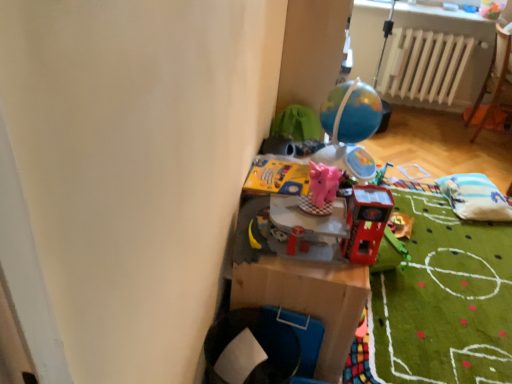
Question: Is shiny metallic globe at upper center, arranged as the first toy when viewed from the back, to the right of white matte radiator at upper right from the viewer's perspective?

Choices:
 (A) yes
 (B) no

Answer: (B)

Question: From a real-world perspective, is shiny metallic globe at upper center, the 4th toy positioned from the front, beneath white matte radiator at upper right?

Choices:
 (A) no
 (B) yes

Answer: (A)

Question: Can you confirm if shiny metallic globe at upper center, the 4th toy positioned from the front, is taller than white matte radiator at upper right?

Choices:
 (A) no
 (B) yes

Answer: (A)

Question: Is shiny metallic globe at upper center, arranged as the first toy when viewed from the back, bigger than white matte radiator at upper right?

Choices:
 (A) no
 (B) yes

Answer: (A)

Question: Is shiny metallic globe at upper center, the 4th toy positioned from the front, smaller than white matte radiator at upper right?

Choices:
 (A) yes
 (B) no

Answer: (A)

Question: From the image's perspective, is yellow cardboard book at center, positioned as the 2th toy in back-to-front order, above or below pink rubber elephant at center, the 3th toy in the back-to-front sequence?

Choices:
 (A) below
 (B) above

Answer: (B)

Question: From a real-world perspective, is yellow cardboard book at center, positioned as the 2th toy in back-to-front order, positioned above or below pink rubber elephant at center, the 3th toy in the back-to-front sequence?

Choices:
 (A) below
 (B) above

Answer: (A)

Question: Looking at their shapes, would you say yellow cardboard book at center, positioned as the 2th toy in back-to-front order, is wider or thinner than pink rubber elephant at center, which appears as the 2th toy when viewed from the front?

Choices:
 (A) wide
 (B) thin

Answer: (A)

Question: In terms of size, does yellow cardboard book at center, positioned as the 2th toy in back-to-front order, appear bigger or smaller than pink rubber elephant at center, the 3th toy in the back-to-front sequence?

Choices:
 (A) big
 (B) small

Answer: (B)

Question: Looking at their shapes, would you say shiny metallic globe at upper center, the 4th toy positioned from the front, is wider or thinner than white fabric bean bag at right?

Choices:
 (A) wide
 (B) thin

Answer: (B)

Question: Relative to white fabric bean bag at right, is shiny metallic globe at upper center, the 4th toy positioned from the front, in front or behind?

Choices:
 (A) behind
 (B) front

Answer: (B)

Question: Is shiny metallic globe at upper center, the 4th toy positioned from the front, situated inside white fabric bean bag at right or outside?

Choices:
 (A) outside
 (B) inside

Answer: (A)

Question: Based on their positions, is shiny metallic globe at upper center, the 4th toy positioned from the front, located to the left or right of white fabric bean bag at right?

Choices:
 (A) right
 (B) left

Answer: (B)

Question: Considering their positions, is metallic red dartboard at center, the 1th toy when ordered from front to back, located in front of or behind white matte radiator at upper right?

Choices:
 (A) behind
 (B) front

Answer: (B)

Question: Looking at their shapes, would you say metallic red dartboard at center, the 4th toy positioned from the back, is wider or thinner than white matte radiator at upper right?

Choices:
 (A) wide
 (B) thin

Answer: (B)